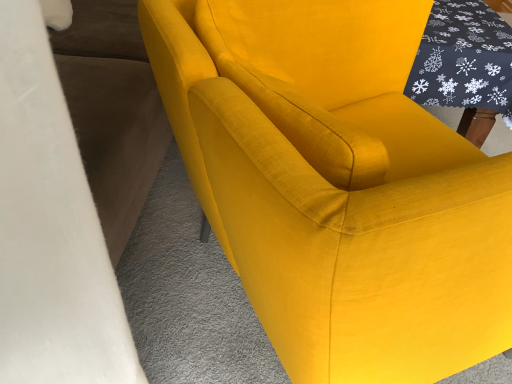
The height and width of the screenshot is (384, 512). Find the location of `dark gray fabric table at upper right`. dark gray fabric table at upper right is located at coordinates (465, 65).

Describe the element at coordinates (465, 65) in the screenshot. I see `dark gray fabric table at upper right` at that location.

In order to face dark gray fabric table at upper right, should I rotate leftwards or rightwards?

Turn right by 23.637 degrees to look at dark gray fabric table at upper right.

What are the coordinates of `matte yellow fabric chair at center` in the screenshot? It's located at (337, 185).

What is the approximate width of matte yellow fabric chair at center?

It is 29.92 inches.

What do you see at coordinates (337, 185) in the screenshot? The image size is (512, 384). I see `matte yellow fabric chair at center` at bounding box center [337, 185].

At what (x,y) coordinates should I click in order to perform the action: click on dark gray fabric table at upper right. Please return your answer as a coordinate pair (x, y). The height and width of the screenshot is (384, 512). Looking at the image, I should click on click(465, 65).

Considering the positions of objects matte yellow fabric chair at center and dark gray fabric table at upper right in the image provided, who is more to the left, matte yellow fabric chair at center or dark gray fabric table at upper right?

From the viewer's perspective, matte yellow fabric chair at center appears more on the left side.

Is matte yellow fabric chair at center positioned in front of dark gray fabric table at upper right?

Yes, the depth of matte yellow fabric chair at center is less than that of dark gray fabric table at upper right.

Considering the positions of point (414, 322) and point (493, 88), is point (414, 322) closer or farther from the camera than point (493, 88)?

Clearly, point (414, 322) is closer to the camera than point (493, 88).

From the image's perspective, which one is positioned lower, matte yellow fabric chair at center or dark gray fabric table at upper right?

matte yellow fabric chair at center.

From a real-world perspective, relative to dark gray fabric table at upper right, is matte yellow fabric chair at center vertically above or below?

From a real-world perspective, matte yellow fabric chair at center is physically above dark gray fabric table at upper right.

Is matte yellow fabric chair at center thinner than dark gray fabric table at upper right?

No.

Which of these two, matte yellow fabric chair at center or dark gray fabric table at upper right, stands taller?

Standing taller between the two is matte yellow fabric chair at center.

Based on their sizes in the image, would you say matte yellow fabric chair at center is bigger or smaller than dark gray fabric table at upper right?

matte yellow fabric chair at center is bigger than dark gray fabric table at upper right.

Looking at this image, is dark gray fabric table at upper right inside matte yellow fabric chair at center?

That's incorrect, dark gray fabric table at upper right is not inside matte yellow fabric chair at center.

From the picture: Are matte yellow fabric chair at center and dark gray fabric table at upper right far apart?

No, there isn't a large distance between matte yellow fabric chair at center and dark gray fabric table at upper right.

Is matte yellow fabric chair at center facing away from dark gray fabric table at upper right?

No.

How many degrees apart are the facing directions of matte yellow fabric chair at center and dark gray fabric table at upper right?

The facing directions of matte yellow fabric chair at center and dark gray fabric table at upper right are 29.1 degrees apart.

Locate an element on the screen. chair below the dark gray fabric table at upper right (from the image's perspective) is located at coordinates (337, 185).

In the scene shown: Which object is positioned more to the left, dark gray fabric table at upper right or matte yellow fabric chair at center?

From the viewer's perspective, matte yellow fabric chair at center appears more on the left side.

Which object is closer to the camera, dark gray fabric table at upper right or matte yellow fabric chair at center?

matte yellow fabric chair at center is closer to the camera.

Which is behind, point (480, 137) or point (472, 178)?

The point (480, 137) is farther from the camera.

From the image's perspective, is dark gray fabric table at upper right positioned above or below matte yellow fabric chair at center?

Clearly, from the image's perspective, dark gray fabric table at upper right is above matte yellow fabric chair at center.

From a real-world perspective, who is located higher, dark gray fabric table at upper right or matte yellow fabric chair at center?

matte yellow fabric chair at center is physically above.

Which object is wider, dark gray fabric table at upper right or matte yellow fabric chair at center?

Result: Wider between the two is matte yellow fabric chair at center.

Can you confirm if dark gray fabric table at upper right is shorter than matte yellow fabric chair at center?

Indeed, dark gray fabric table at upper right has a lesser height compared to matte yellow fabric chair at center.

Considering the sizes of objects dark gray fabric table at upper right and matte yellow fabric chair at center in the image provided, who is bigger, dark gray fabric table at upper right or matte yellow fabric chair at center?

With larger size is matte yellow fabric chair at center.

Would you say dark gray fabric table at upper right contains matte yellow fabric chair at center?

No.

Is dark gray fabric table at upper right beside matte yellow fabric chair at center?

No, dark gray fabric table at upper right is not with matte yellow fabric chair at center.

Is dark gray fabric table at upper right positioned with its back to matte yellow fabric chair at center?

No, matte yellow fabric chair at center is not at the back of dark gray fabric table at upper right.

What's the angular difference between dark gray fabric table at upper right and matte yellow fabric chair at center's facing directions?

The facing directions of dark gray fabric table at upper right and matte yellow fabric chair at center are 29.1 degrees apart.

This screenshot has width=512, height=384. Find the location of `chair that is on the left side of dark gray fabric table at upper right`. chair that is on the left side of dark gray fabric table at upper right is located at coordinates (337, 185).

This screenshot has height=384, width=512. I want to click on chair located on the left of dark gray fabric table at upper right, so click(337, 185).

This screenshot has height=384, width=512. Find the location of `chair below the dark gray fabric table at upper right (from the image's perspective)`. chair below the dark gray fabric table at upper right (from the image's perspective) is located at coordinates (337, 185).